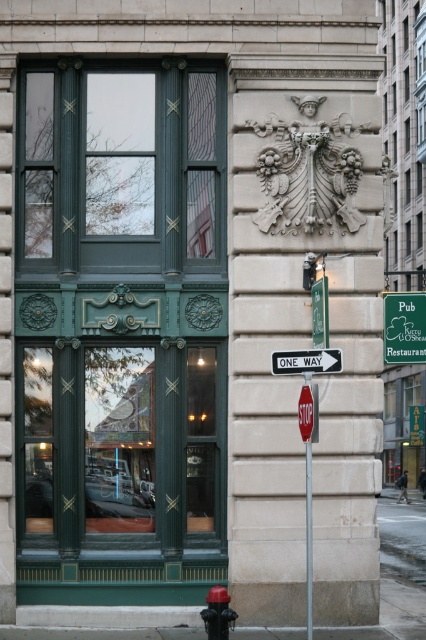
Question: Can you confirm if white plastic sign at center is smaller than red painted metal stop sign at center?

Choices:
 (A) yes
 (B) no

Answer: (B)

Question: Is green matte window at center smaller than metallic pole at center?

Choices:
 (A) no
 (B) yes

Answer: (A)

Question: Which point appears closest to the camera in this image?

Choices:
 (A) (314, 284)
 (B) (322, 365)
 (C) (391, 317)
 (D) (227, 636)

Answer: (D)

Question: Which object appears closest to the camera in this image?

Choices:
 (A) white plastic sign at center
 (B) green plastic sign at center right
 (C) red plastic fire hydrant at lower center

Answer: (C)

Question: Considering the relative positions of red plastic fire hydrant at lower center and red painted metal stop sign at center in the image provided, where is red plastic fire hydrant at lower center located with respect to red painted metal stop sign at center?

Choices:
 (A) below
 (B) above

Answer: (A)

Question: Based on their relative distances, which object is nearer to the red plastic fire hydrant at lower center?

Choices:
 (A) green matte window at center
 (B) metallic pole at center

Answer: (B)